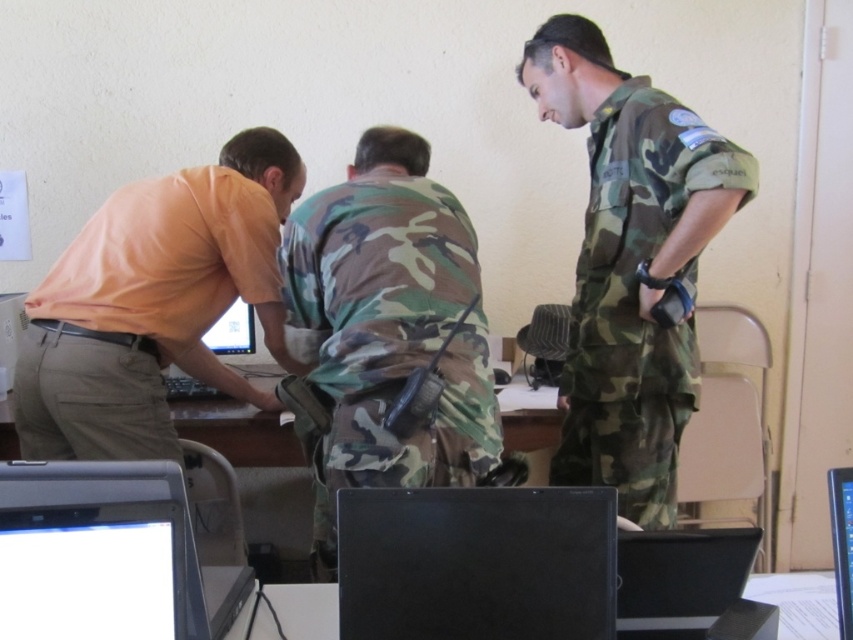
Question: Can you confirm if orange cotton shirt at left is positioned to the left of matte white monitor at center?

Choices:
 (A) yes
 (B) no

Answer: (B)

Question: Can you confirm if black glossy laptop at lower left is positioned below black glossy laptop at lower center?

Choices:
 (A) yes
 (B) no

Answer: (B)

Question: Among these objects, which one is nearest to the camera?

Choices:
 (A) camo fabric uniform at center
 (B) black glossy laptop at lower center
 (C) black plastic table at lower center

Answer: (B)

Question: Which object appears farthest from the camera in this image?

Choices:
 (A) black glossy monitor at lower right
 (B) matte white monitor at center
 (C) wooden desk at center

Answer: (B)

Question: Does black glossy laptop at lower left have a smaller size compared to black plastic table at lower center?

Choices:
 (A) yes
 (B) no

Answer: (B)

Question: Which object is positioned farthest from the black glossy laptop at lower center?

Choices:
 (A) wooden desk at center
 (B) black plastic table at lower center

Answer: (A)